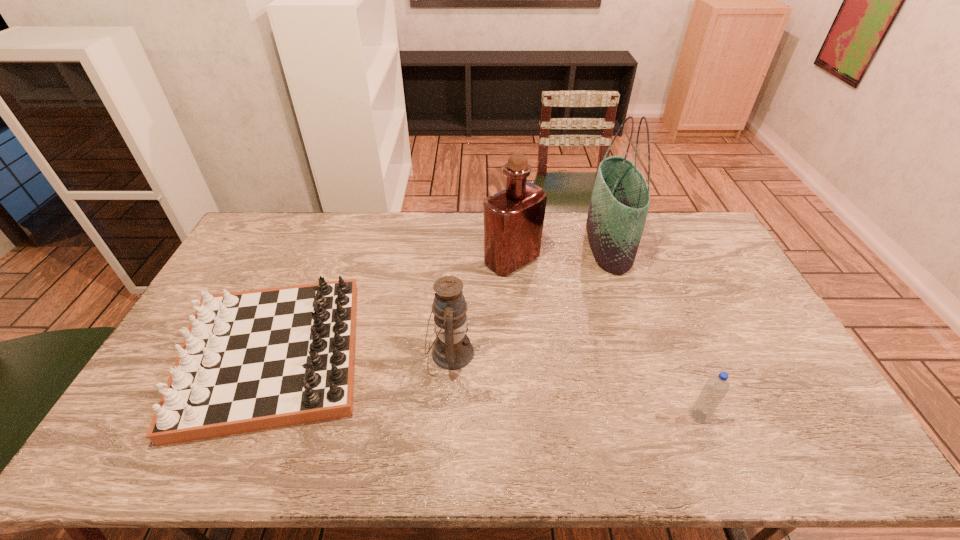
Identify the location of the tallest object. This screenshot has width=960, height=540. (620, 200).

Image resolution: width=960 pixels, height=540 pixels. Identify the location of the fourth shortest object. (513, 218).

Locate an element on the screen. the third object from right to left is located at coordinates pos(513,218).

Locate an element on the screen. The width and height of the screenshot is (960, 540). the third shortest object is located at coordinates (452, 350).

This screenshot has width=960, height=540. Identify the location of oil lamp. tap(452, 350).

Locate an element on the screen. The height and width of the screenshot is (540, 960). the second shortest object is located at coordinates (716, 387).

Locate an element on the screen. This screenshot has height=540, width=960. the leftmost object is located at coordinates (254, 360).

Locate an element on the screen. The image size is (960, 540). gameboard is located at coordinates (254, 360).

This screenshot has width=960, height=540. I want to click on vacant space situated 0.370m on the front of the tallest object, so click(650, 366).

Identify the location of vacant space located 0.320m on the right of the third object from right to left. The width and height of the screenshot is (960, 540). (631, 260).